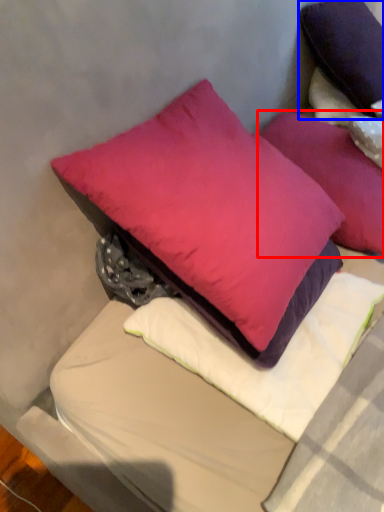
Question: Among these objects, which one is farthest to the camera, pillow (highlighted by a red box) or pillow (highlighted by a blue box)?

Choices:
 (A) pillow
 (B) pillow

Answer: (B)